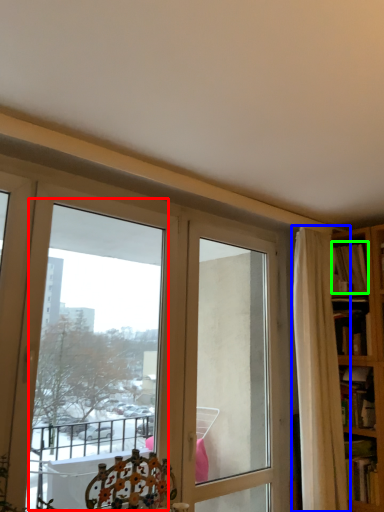
Question: Which object is positioned farthest from bay window (highlighted by a red box)? Select from curtain (highlighted by a blue box) and book (highlighted by a green box).

Choices:
 (A) curtain
 (B) book

Answer: (B)